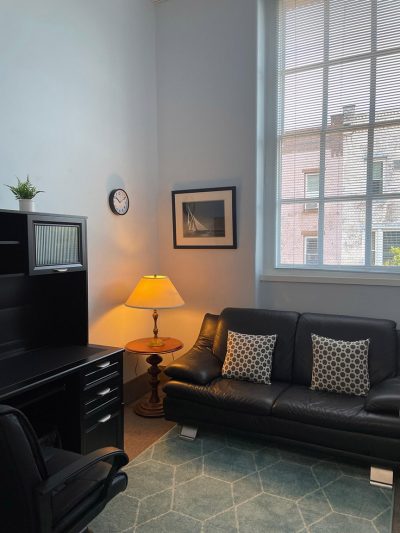
I want to click on right sofa leg, so click(x=379, y=478).